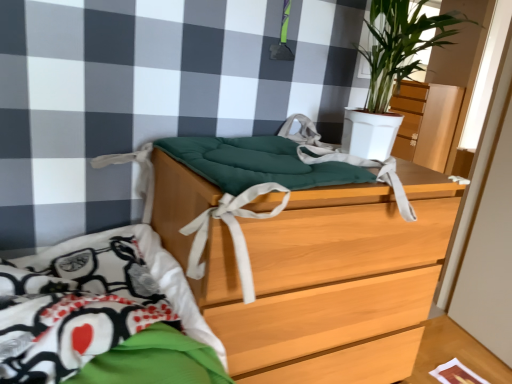
Question: Can you confirm if green matte plant at upper right is wider than wooden chest of drawers at center?

Choices:
 (A) yes
 (B) no

Answer: (B)

Question: Is green matte plant at upper right bigger than wooden chest of drawers at center?

Choices:
 (A) no
 (B) yes

Answer: (A)

Question: Does green matte plant at upper right lie behind wooden chest of drawers at center?

Choices:
 (A) yes
 (B) no

Answer: (A)

Question: Can you confirm if green matte plant at upper right is positioned to the left of wooden chest of drawers at center?

Choices:
 (A) yes
 (B) no

Answer: (B)

Question: Is green matte plant at upper right to the right of wooden chest of drawers at center from the viewer's perspective?

Choices:
 (A) no
 (B) yes

Answer: (B)

Question: Is point (407, 314) closer or farther from the camera than point (419, 23)?

Choices:
 (A) closer
 (B) farther

Answer: (B)

Question: Considering the positions of wooden chest of drawers at center and green matte plant at upper right in the image, is wooden chest of drawers at center bigger or smaller than green matte plant at upper right?

Choices:
 (A) big
 (B) small

Answer: (A)

Question: From a real-world perspective, is wooden chest of drawers at center positioned above or below green matte plant at upper right?

Choices:
 (A) above
 (B) below

Answer: (B)

Question: Is wooden chest of drawers at center to the left or to the right of green matte plant at upper right in the image?

Choices:
 (A) right
 (B) left

Answer: (B)

Question: Is green matte plant at upper right spatially inside wooden chest of drawers at center, or outside of it?

Choices:
 (A) inside
 (B) outside

Answer: (B)

Question: Is point (373, 29) closer or farther from the camera than point (325, 322)?

Choices:
 (A) closer
 (B) farther

Answer: (B)

Question: Considering their positions, is green matte plant at upper right located in front of or behind wooden chest of drawers at center?

Choices:
 (A) front
 (B) behind

Answer: (B)

Question: Is green matte plant at upper right wider or thinner than wooden chest of drawers at center?

Choices:
 (A) wide
 (B) thin

Answer: (B)

Question: Is green matte plant at upper right to the left or to the right of matte wood dresser at upper right in the image?

Choices:
 (A) left
 (B) right

Answer: (A)

Question: Considering the positions of green matte plant at upper right and matte wood dresser at upper right in the image, is green matte plant at upper right taller or shorter than matte wood dresser at upper right?

Choices:
 (A) tall
 (B) short

Answer: (B)